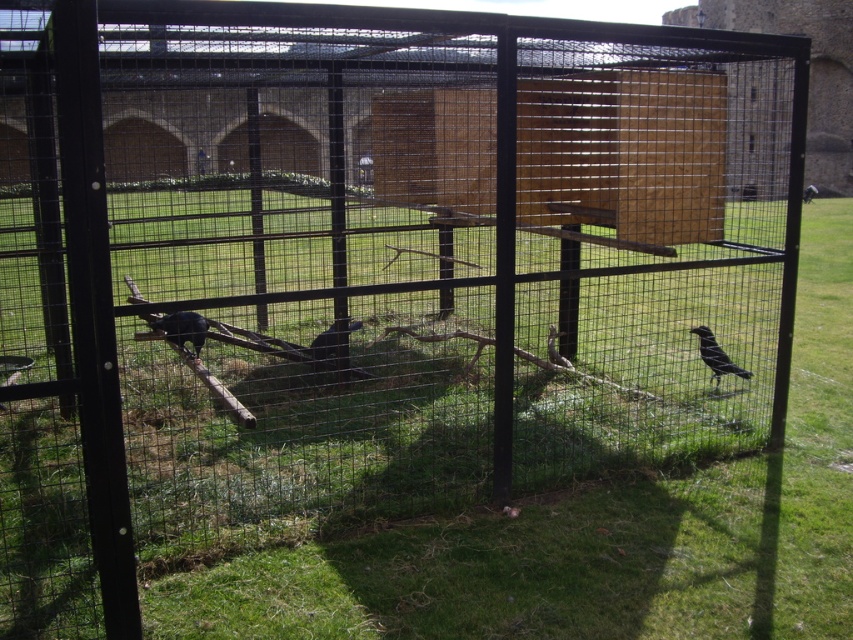
You are standing outside the enclosure and want to feed the black matte bird at right. The food you have is in a container that can project food up to 5 meters. Will the food reach the bird?

The black matte bird at right is 5.55 meters from the camera, which is beyond the 5 meter range of the food container. Therefore, the food will not reach the bird.

You are a zookeeper who wants to place a new feeding station in the enclosure. The feeding station must be placed at least 1 meter away from any birds to avoid disturbance. Given the coordinates of the shiny black bird at center, can you confirm if the feeding station can be placed at point (x=183, y=328)?

The point (x=183, y=328) is where the shiny black bird at center is located, so placing the feeding station there would be too close to the bird, violating the 1 meter distance requirement. Choose another location.